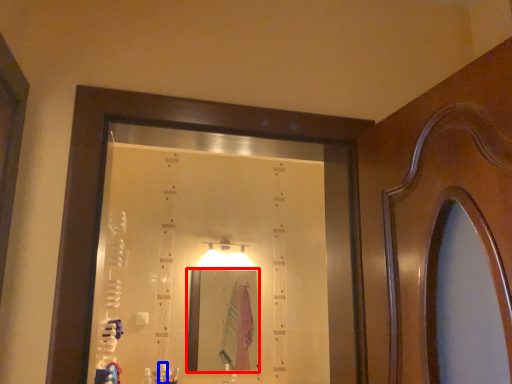
Question: Which object appears closest to the camera in this image, mirror (highlighted by a red box) or toiletry (highlighted by a blue box)?

Choices:
 (A) mirror
 (B) toiletry

Answer: (B)